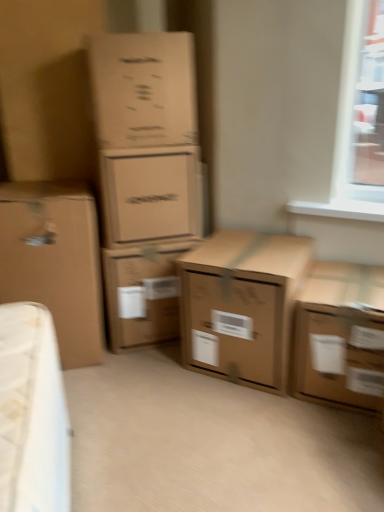
Question: From a real-world perspective, is brown cardboard box at upper left, the second box viewed from the left, above or below brown cardboard box at center, the third box positioned from the right?

Choices:
 (A) above
 (B) below

Answer: (A)

Question: In terms of width, does brown cardboard box at upper left, the second box viewed from the left, look wider or thinner when compared to brown cardboard box at center, the third box positioned from the right?

Choices:
 (A) thin
 (B) wide

Answer: (A)

Question: Based on their relative distances, which object is nearer to the brown cardboard box at left, which is counted as the sixth box, starting from the right?

Choices:
 (A) brown cardboard box at lower right, the 1th box positioned from the right
 (B) brown cardboard box at center, the 4th box from the left
 (C) brown cardboard box at center, positioned as the 2th box in right-to-left order
 (D) matte cardboard box at center, marked as the 3th box in a left-to-right arrangement
 (E) brown cardboard box at upper left, the second box viewed from the left

Answer: (B)

Question: Based on their relative distances, which object is farther from the brown cardboard box at center, the 4th box from the left?

Choices:
 (A) brown cardboard box at center, positioned as the 2th box in right-to-left order
 (B) brown cardboard box at left, which is counted as the sixth box, starting from the right
 (C) matte cardboard box at center, the fourth box when ordered from right to left
 (D) brown cardboard box at lower right, which appears as the sixth box when viewed from the left
 (E) brown cardboard box at upper left, the second box viewed from the left

Answer: (D)